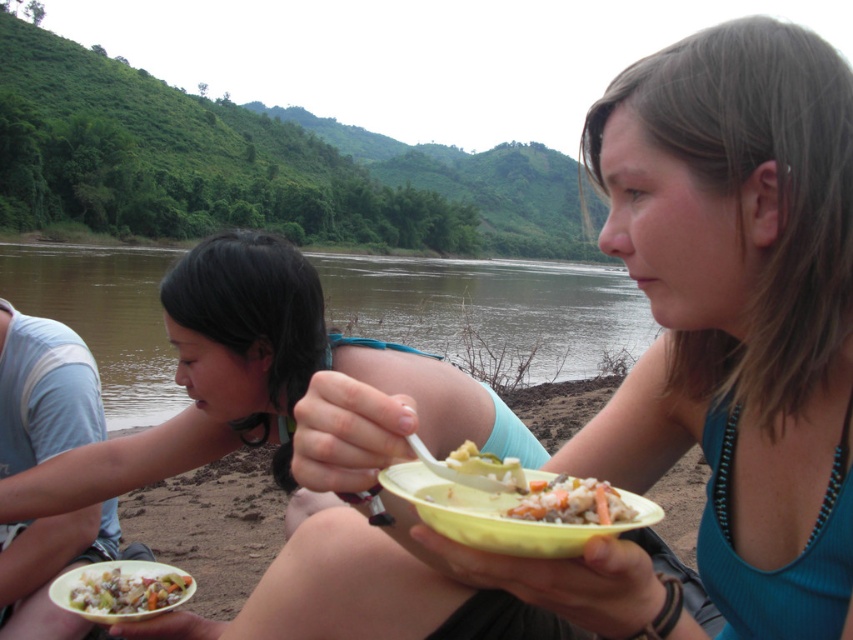
Question: Can you confirm if matte yellow bowl at center is positioned below shiny plastic bowl at lower left?

Choices:
 (A) no
 (B) yes

Answer: (A)

Question: Among these objects, which one is nearest to the camera?

Choices:
 (A) shiny plastic bowl at lower left
 (B) matte yellow bowl at center
 (C) yellow plastic bowl at center

Answer: (C)

Question: Which point appears farthest from the camera in this image?

Choices:
 (A) coord(293,573)
 (B) coord(170,595)
 (C) coord(454,349)
 (D) coord(473,516)

Answer: (C)

Question: Does yellow plastic bowl at center appear under shiny plastic bowl at lower left?

Choices:
 (A) no
 (B) yes

Answer: (A)

Question: Estimate the real-world distances between objects in this image. Which object is farther from the matte yellow bowl at center?

Choices:
 (A) brown water at river left
 (B) shiny plastic bowl at lower left

Answer: (A)

Question: Does brown water at river left appear on the right side of shiny plastic bowl at lower left?

Choices:
 (A) no
 (B) yes

Answer: (A)